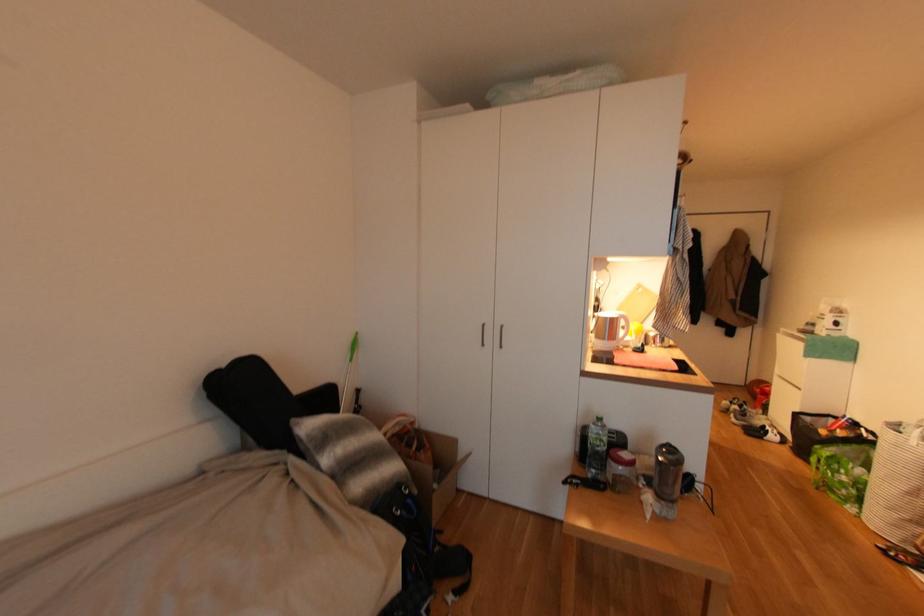
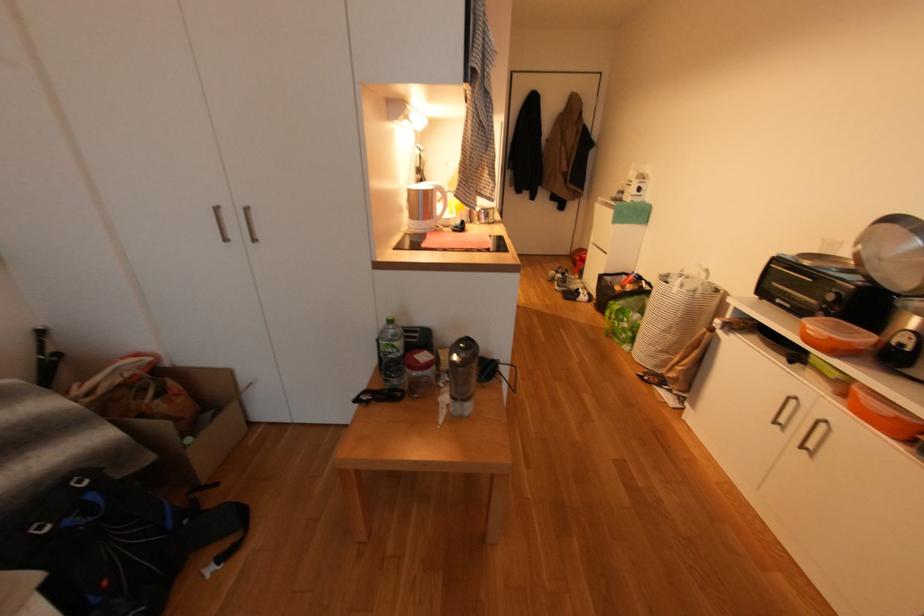
What movement of the cameraman would produce the second image?

The movement direction of the cameraman is right, forward.